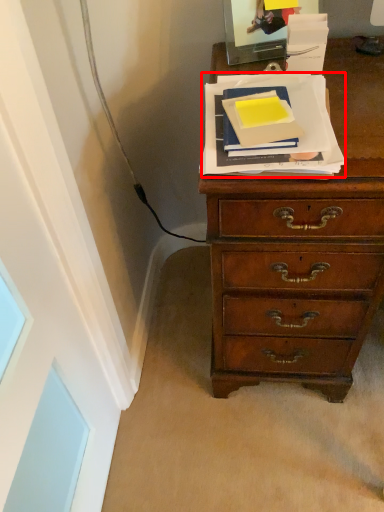
Question: From the image's perspective, what is the correct spatial positioning of paperback book (annotated by the red box) in reference to paperback book?

Choices:
 (A) above
 (B) below

Answer: (B)